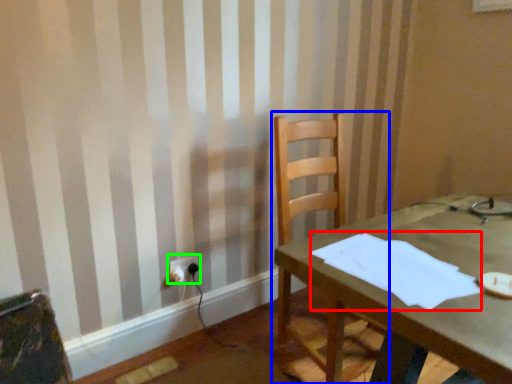
Question: Which object is the farthest from paper (highlighted by a red box)? Choose among these: chair (highlighted by a blue box) or electric outlet (highlighted by a green box).

Choices:
 (A) chair
 (B) electric outlet

Answer: (B)